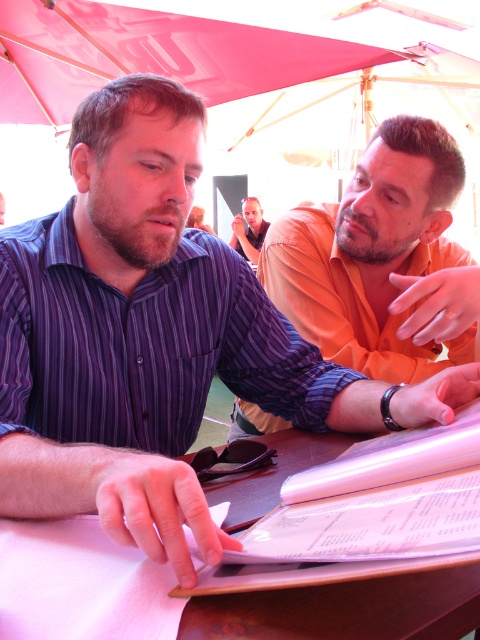
Question: Is orange matte shirt at upper right above pink fabric canopy at upper center?

Choices:
 (A) yes
 (B) no

Answer: (B)

Question: Is pink fabric canopy at upper center further to camera compared to matte orange shirt at center?

Choices:
 (A) yes
 (B) no

Answer: (B)

Question: Which of the following is the farthest from the observer?

Choices:
 (A) (202, 22)
 (B) (257, 216)

Answer: (B)

Question: Is purple striped shirt at left smaller than brown wooden table at center?

Choices:
 (A) yes
 (B) no

Answer: (B)

Question: Which object appears farthest from the camera in this image?

Choices:
 (A) orange matte shirt at upper right
 (B) matte orange shirt at center
 (C) pink fabric canopy at upper center
 (D) brown wooden table at center

Answer: (B)

Question: Based on their relative distances, which object is farther from the matte orange shirt at center?

Choices:
 (A) pink fabric canopy at upper center
 (B) brown wooden table at center
 (C) orange matte shirt at upper right

Answer: (B)